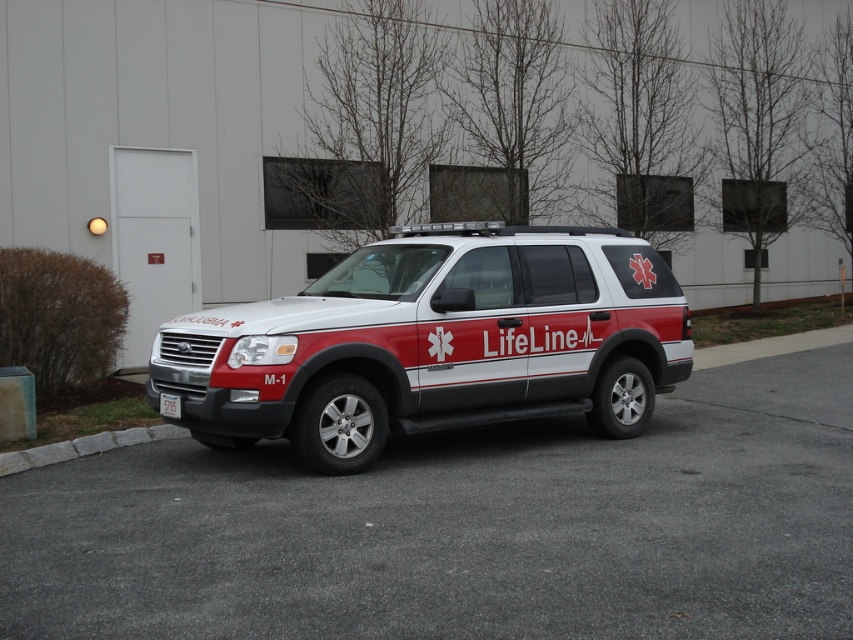
Does white matte suv at center have a larger size compared to white plastic license plate at center?

Indeed, white matte suv at center has a larger size compared to white plastic license plate at center.

Can you confirm if white matte suv at center is shorter than white plastic license plate at center?

In fact, white matte suv at center may be taller than white plastic license plate at center.

Does point (598, 371) come in front of point (167, 394)?

No.

The width and height of the screenshot is (853, 640). What are the coordinates of `white matte suv at center` in the screenshot? It's located at (434, 342).